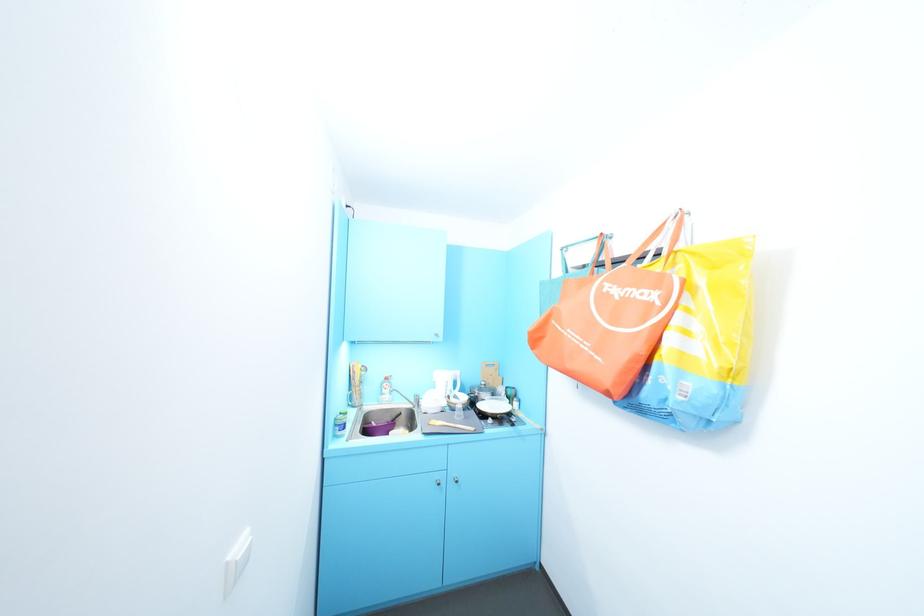
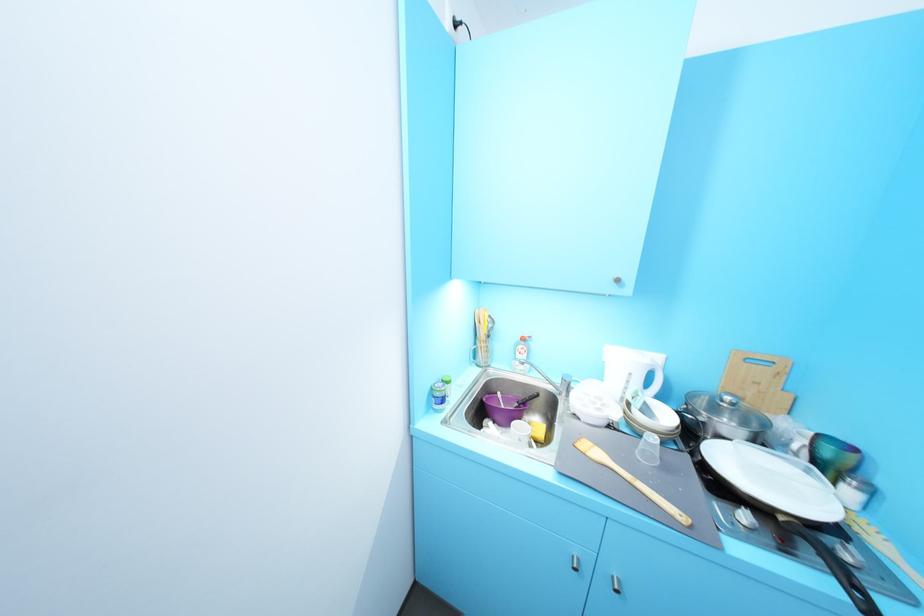
Question: The camera is either moving clockwise (left) or counter-clockwise (right) around the object. The first image is from the beginning of the video and the second image is from the end. Is the camera moving left or right when shooting the video?

Choices:
 (A) Left
 (B) Right

Answer: (B)